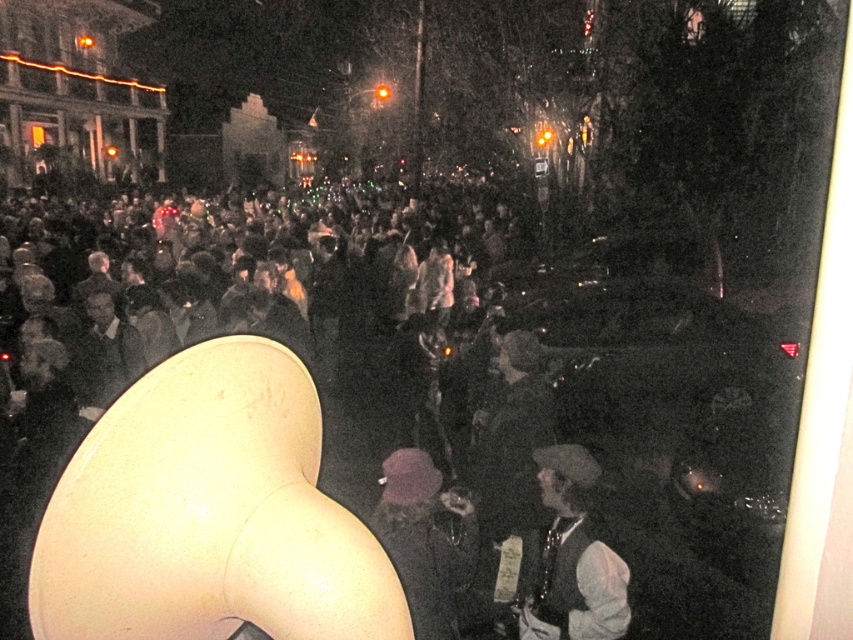
Question: Estimate the real-world distances between objects in this image. Which object is closer to the white matte megaphone at center?

Choices:
 (A) purple fabric hat at center
 (B) white fabric hat at lower right

Answer: (B)

Question: Is white matte megaphone at center to the left of white fabric hat at lower right from the viewer's perspective?

Choices:
 (A) yes
 (B) no

Answer: (A)

Question: Can you confirm if white matte megaphone at center is positioned to the left of purple fabric hat at center?

Choices:
 (A) yes
 (B) no

Answer: (A)

Question: Which of the following is the closest to the observer?

Choices:
 (A) purple fabric hat at center
 (B) white fabric hat at lower right

Answer: (A)

Question: Which point is closer to the camera?

Choices:
 (A) (393, 232)
 (B) (537, 595)

Answer: (B)

Question: Is white matte megaphone at center to the right of purple fabric hat at center from the viewer's perspective?

Choices:
 (A) no
 (B) yes

Answer: (A)